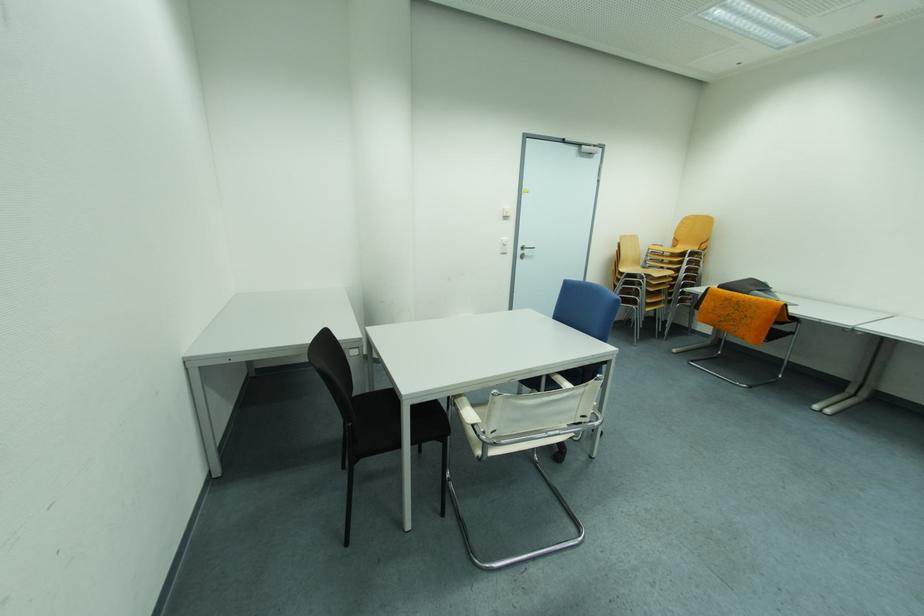
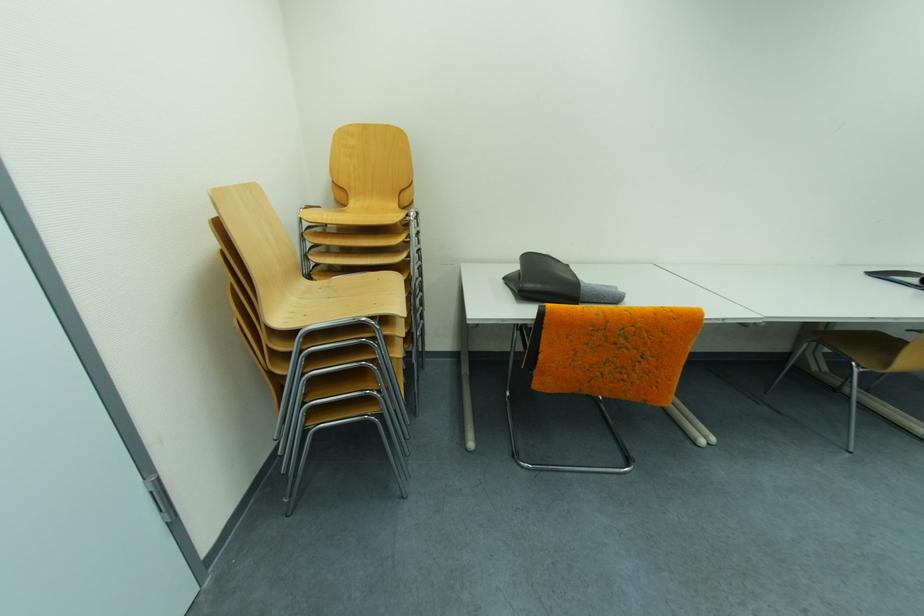
Locate, in the second image, the point that corresponds to (711,308) in the first image.

(549, 359)